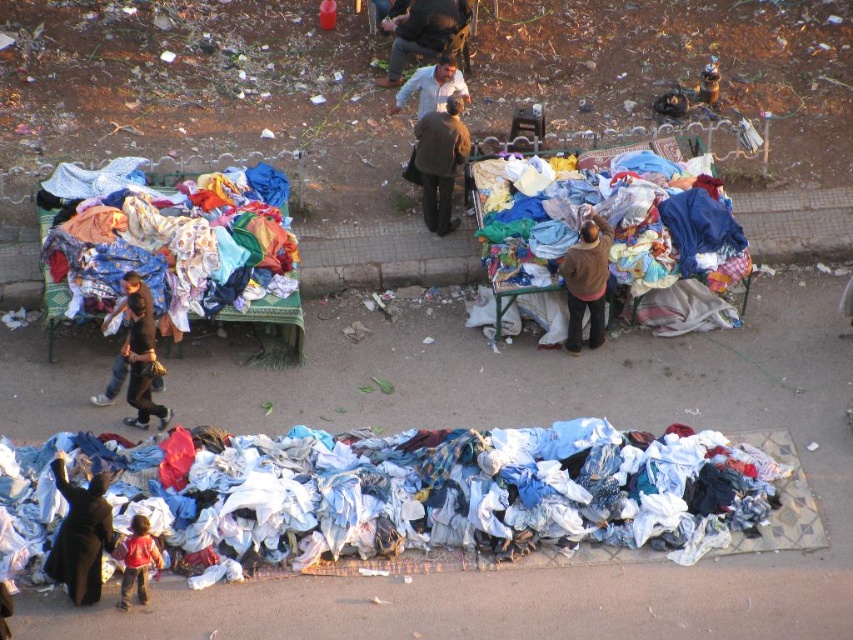
You are a customer at the market and want to pick up the multicolored fabric at center and the white matte shirt at center. Which one do you need to reach for first?

The multicolored fabric at center is closer to the viewer than the white matte shirt at center, so you should reach for the multicolored fabric at center first.

You are a customer at this market and want to compare the height of the dark brown fabric at lower left and the brown woolen sweater at center. Which one is taller?

The brown woolen sweater at center is taller than the dark brown fabric at lower left.

You are a customer at the market and want to buy a shirt that is not covered by any other items. Based on the scene, which item is more likely to be accessible, the multicolored fabric at center or the white matte shirt at center?

The white matte shirt at center is more likely to be accessible because the multicolored fabric at center might be wider and could be covering it.